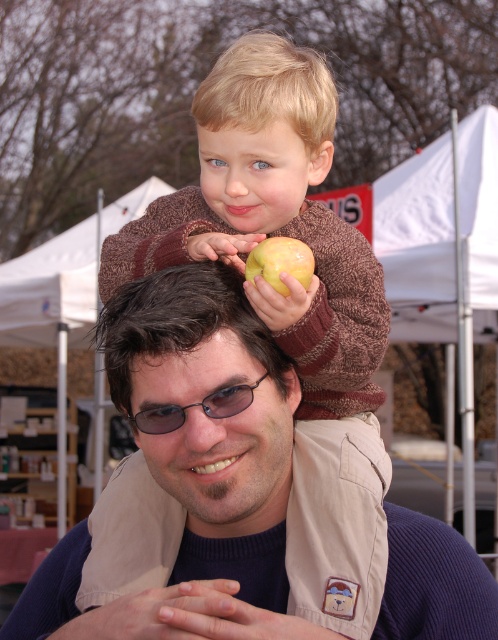
Who is more forward, (x=100, y=273) or (x=211, y=157)?

Point (x=211, y=157) is in front.

Between brown knitted sweater at upper center and blonde hair at upper center, which one appears on the left side from the viewer's perspective?

brown knitted sweater at upper center is more to the left.

Is point (122, 276) farther from viewer compared to point (207, 88)?

Yes, it is behind point (207, 88).

At what (x,y) coordinates should I click in order to perform the action: click on brown knitted sweater at upper center. Please return your answer as a coordinate pair (x, y). Image resolution: width=498 pixels, height=640 pixels. Looking at the image, I should click on (271, 220).

Which is more to the right, brown hair at center or yellow matte apple at upper center?

Positioned to the right is yellow matte apple at upper center.

Consider the image. Can you confirm if brown hair at center is thinner than yellow matte apple at upper center?

No.

This screenshot has width=498, height=640. What do you see at coordinates (204, 394) in the screenshot?
I see `brown hair at center` at bounding box center [204, 394].

Find the location of `brown hair at center`. brown hair at center is located at coordinates (204, 394).

Is matte brown vest at center smaller than blonde hair at upper center?

Incorrect, matte brown vest at center is not smaller in size than blonde hair at upper center.

Between matte brown vest at center and blonde hair at upper center, which one has less height?

Standing shorter between the two is blonde hair at upper center.

Which is behind, point (181, 502) or point (274, 157)?

Point (274, 157)

Where is `matte brown vest at center`? This screenshot has width=498, height=640. matte brown vest at center is located at coordinates (193, 467).